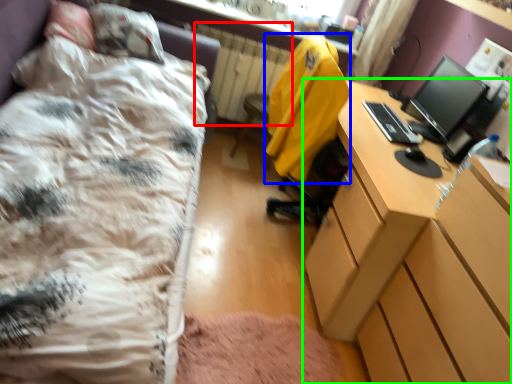
Question: Considering the real-world distances, which object is closest to radiator (highlighted by a red box)? jacket (highlighted by a blue box) or desk (highlighted by a green box).

Choices:
 (A) jacket
 (B) desk

Answer: (A)